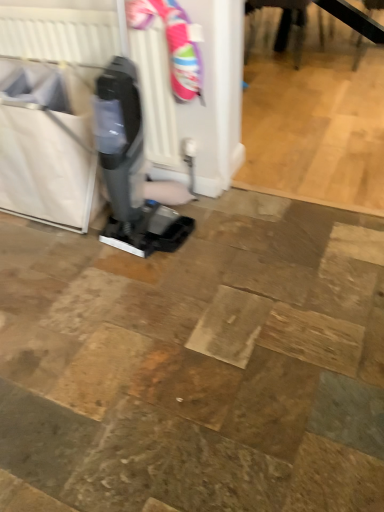
Question: From the image's perspective, is white fabric laundry basket at left positioned above or below white plastic radiator at upper left?

Choices:
 (A) below
 (B) above

Answer: (A)

Question: From a real-world perspective, is white fabric laundry basket at left physically located above or below white plastic radiator at upper left?

Choices:
 (A) above
 (B) below

Answer: (B)

Question: Based on their positions, is white fabric laundry basket at left located to the left or right of white plastic radiator at upper left?

Choices:
 (A) right
 (B) left

Answer: (B)

Question: Is point (170, 154) closer or farther from the camera than point (3, 168)?

Choices:
 (A) closer
 (B) farther

Answer: (B)

Question: Is white plastic radiator at upper left to the left or to the right of white fabric laundry basket at left in the image?

Choices:
 (A) left
 (B) right

Answer: (B)

Question: From their relative heights in the image, would you say white plastic radiator at upper left is taller or shorter than white fabric laundry basket at left?

Choices:
 (A) short
 (B) tall

Answer: (B)

Question: From a real-world perspective, is white plastic radiator at upper left positioned above or below white fabric laundry basket at left?

Choices:
 (A) below
 (B) above

Answer: (B)